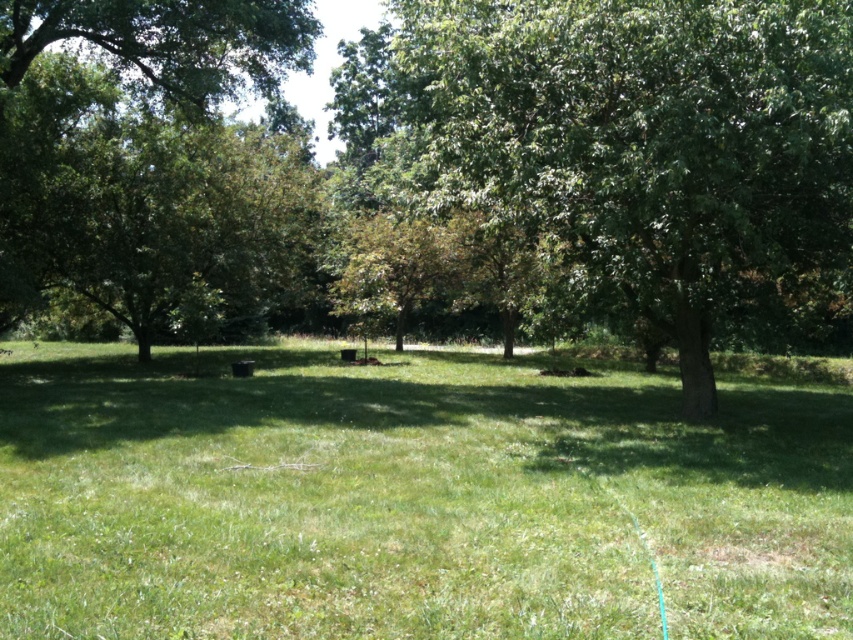
Question: Is the position of green grassy field at center less distant than that of green leafy tree at left?

Choices:
 (A) no
 (B) yes

Answer: (B)

Question: Based on their relative distances, which object is farther from the green grassy field at center?

Choices:
 (A) green leafy tree at center
 (B) green leafy tree at left

Answer: (B)

Question: Which point appears farthest from the camera in this image?

Choices:
 (A) (502, 156)
 (B) (206, 28)

Answer: (B)

Question: Is the position of green leafy tree at center more distant than that of green leafy tree at left?

Choices:
 (A) no
 (B) yes

Answer: (A)

Question: Which of the following is the farthest from the observer?

Choices:
 (A) green leafy tree at left
 (B) green grassy field at center
 (C) green leafy tree at center

Answer: (A)

Question: In this image, where is green grassy field at center located relative to green leafy tree at center?

Choices:
 (A) left
 (B) right

Answer: (A)